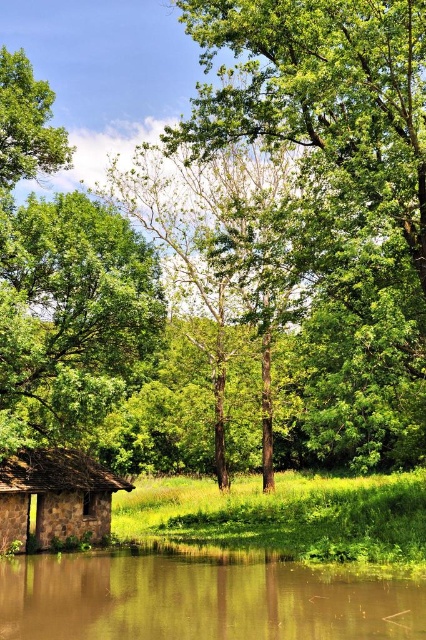
Question: Does brown murky water at lower center appear over stone hut at lower left?

Choices:
 (A) no
 (B) yes

Answer: (A)

Question: Is brown murky water at lower center smaller than stone hut at lower left?

Choices:
 (A) no
 (B) yes

Answer: (A)

Question: Is brown murky water at lower center positioned in front of stone hut at lower left?

Choices:
 (A) no
 (B) yes

Answer: (B)

Question: Which point is closer to the camera?

Choices:
 (A) (236, 608)
 (B) (423, 221)
 (C) (6, 516)

Answer: (A)

Question: Which of the following is the closest to the observer?

Choices:
 (A) (42, 536)
 (B) (126, 570)

Answer: (B)

Question: Considering the real-world distances, which object is closest to the green leafy tree at center?

Choices:
 (A) brown murky water at lower center
 (B) stone hut at lower left

Answer: (A)